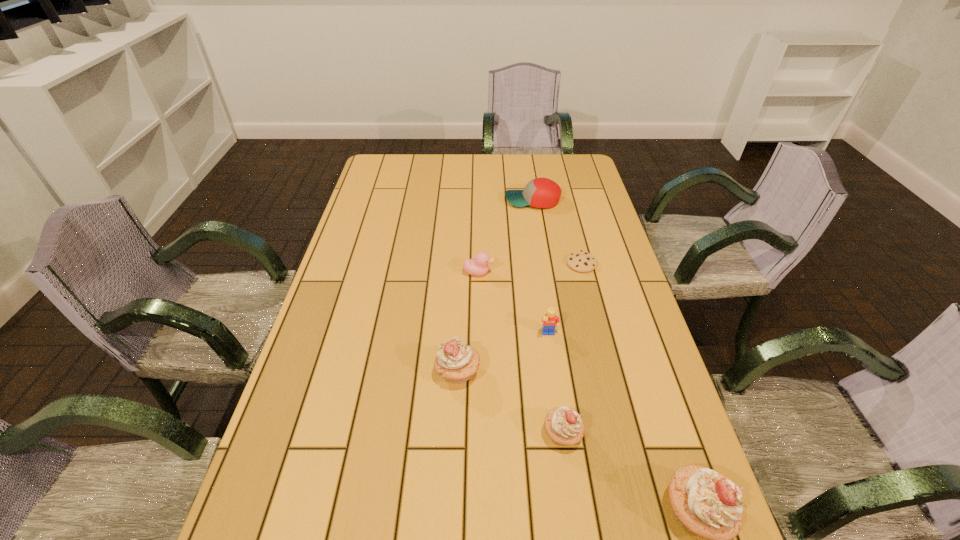
Where is `free location located 0.340m at the brim of the farthest object`? The width and height of the screenshot is (960, 540). free location located 0.340m at the brim of the farthest object is located at coordinates (414, 201).

The height and width of the screenshot is (540, 960). I want to click on vacant space located 0.060m at the brim of the farthest object, so click(489, 201).

Where is `vacant region located at the brim of the farthest object`? vacant region located at the brim of the farthest object is located at coordinates (484, 201).

The image size is (960, 540). Identify the location of free spot located 0.310m on the front-facing side of the duckling. (595, 273).

Find the location of a particular element. vacant position located 0.320m on the face of the Lego is located at coordinates (567, 461).

Where is `free space located 0.240m on the back of the cookie`? The width and height of the screenshot is (960, 540). free space located 0.240m on the back of the cookie is located at coordinates (568, 211).

The width and height of the screenshot is (960, 540). Identify the location of baseball cap at the right edge. (540, 192).

Where is `cookie at the right edge`? This screenshot has height=540, width=960. cookie at the right edge is located at coordinates (584, 262).

Find the location of a particular element. Image resolution: width=960 pixels, height=540 pixels. vacant space at the near edge of the desktop is located at coordinates (420, 525).

I want to click on vacant space at the left edge of the desktop, so click(x=380, y=284).